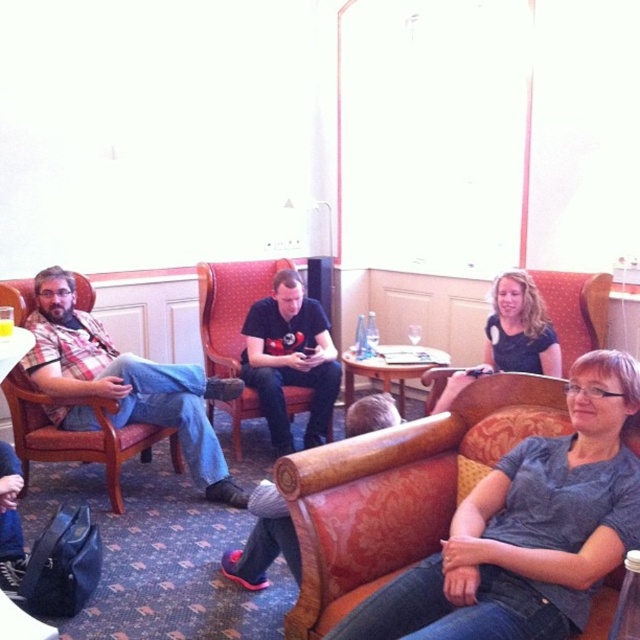
You are a photographer setting up a shoot in this lounge. You want to ensure that both the gray cotton shirt at center and the plaid fabric shirt at left are clearly visible in the photo. Based on their positions, which shirt should you focus on first to ensure both are in frame?

The gray cotton shirt at center is in front of the plaid fabric shirt at left, so you should focus on the plaid fabric shirt at left first to ensure both are visible without one blocking the other.